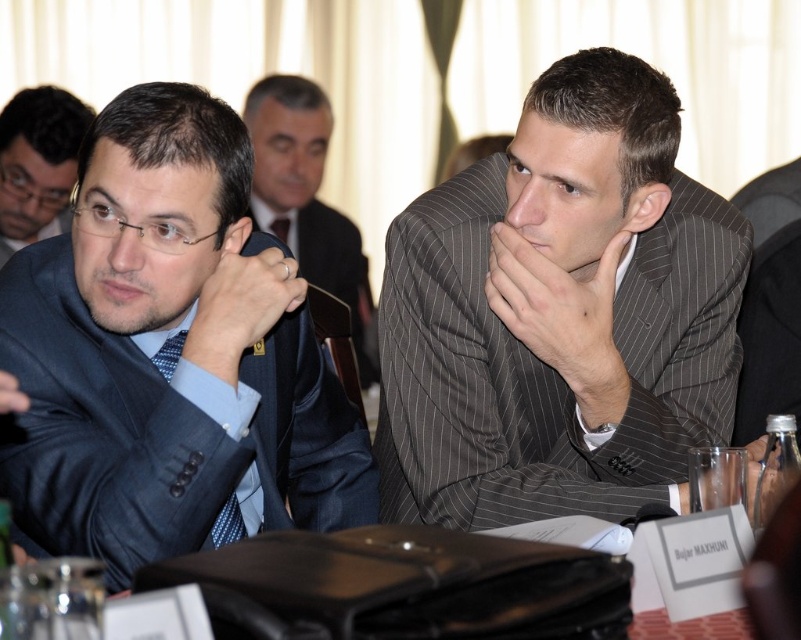
Who is positioned more to the left, matte blue suit at left or blue silk tie at center?

blue silk tie at center

Does matte blue suit at left appear over blue silk tie at center?

No, matte blue suit at left is not above blue silk tie at center.

Between point (218, 141) and point (282, 241), which one is positioned behind?

The point (282, 241) is behind.

Where is `matte blue suit at left`? This screenshot has height=640, width=801. matte blue suit at left is located at coordinates (168, 355).

Which is below, matte black suit at left or blue silk tie at center?

blue silk tie at center

Between matte black suit at left and blue silk tie at center, which one has less height?

blue silk tie at center

I want to click on matte black suit at left, so pos(37,161).

Is the position of matte blue suit at left more distant than that of dark blue suit at center?

No, matte blue suit at left is in front of dark blue suit at center.

Can you confirm if matte blue suit at left is wider than dark blue suit at center?

Yes, matte blue suit at left is wider than dark blue suit at center.

Who is more distant from viewer, (91, 496) or (288, 182)?

The point (288, 182) is more distant.

Find the location of a particular element. matte blue suit at left is located at coordinates (168, 355).